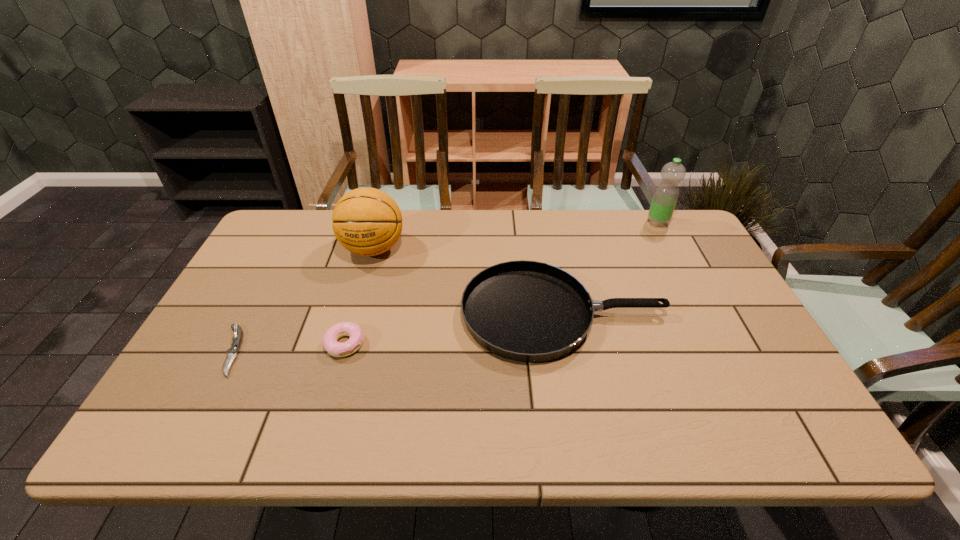
I want to click on vacant space in between the pocketknife and the third tallest object, so click(x=397, y=333).

Locate which object ranks fourth in proximity to the water bottle. Please provide its 2D coordinates. Your answer should be formatted as a tuple, i.e. [(x, y)], where the tuple contains the x and y coordinates of a point satisfying the conditions above.

[(237, 339)]

Identify which object is the third closest to the farthest object. Please provide its 2D coordinates. Your answer should be formatted as a tuple, i.e. [(x, y)], where the tuple contains the x and y coordinates of a point satisfying the conditions above.

[(330, 337)]

You are a GUI agent. You are given a task and a screenshot of the screen. Output one action in this format:
    pyautogui.click(x=<x>, y=<y>)
    Task: Click on the free space that satisfies the following two spatial constraints: 1. on the back side of the rightmost object; 2. on the right side of the leftmost object
    This screenshot has height=540, width=960.
    Given the screenshot: What is the action you would take?
    pyautogui.click(x=299, y=223)